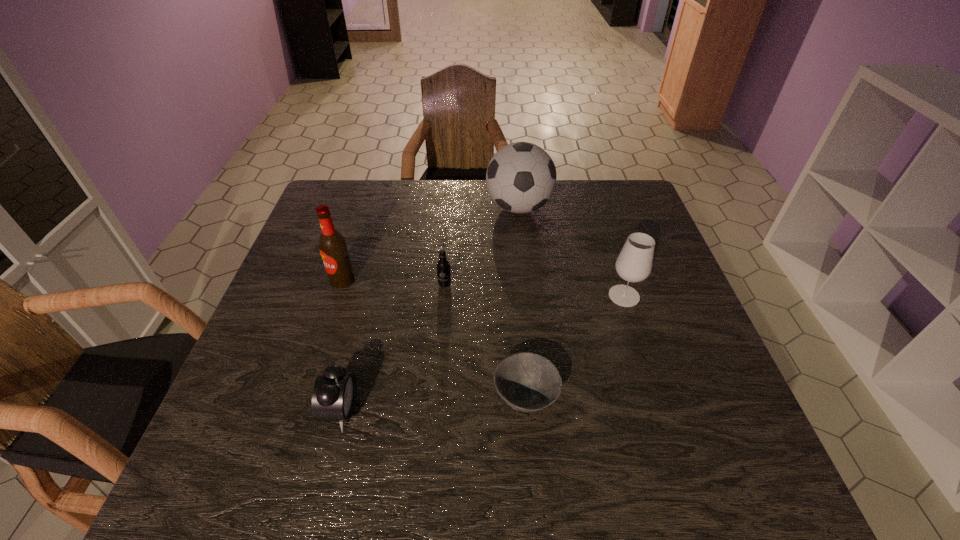
Where is `empty space that is in between the leftmost object and the third shortest object`? The height and width of the screenshot is (540, 960). empty space that is in between the leftmost object and the third shortest object is located at coordinates (394, 282).

The width and height of the screenshot is (960, 540). In order to click on free area in between the root beer and the fifth object from right to left in this screenshot , I will do `click(393, 347)`.

Locate an element on the screen. vacant area between the bowl and the third tallest object is located at coordinates (575, 347).

The image size is (960, 540). I want to click on free space between the fifth tallest object and the third object from left to right, so click(393, 347).

Where is `free space between the root beer and the farthest object`? free space between the root beer and the farthest object is located at coordinates (482, 246).

Locate which object ranks second in proximity to the fourth object from right to left. Please provide its 2D coordinates. Your answer should be formatted as a tuple, i.e. [(x, y)], where the tuple contains the x and y coordinates of a point satisfying the conditions above.

[(521, 177)]

Image resolution: width=960 pixels, height=540 pixels. I want to click on the fourth closest object to the root beer, so click(334, 395).

Locate an element on the screen. vacant space that satisfies the following two spatial constraints: 1. on the label of the root beer; 2. on the front side of the alarm clock is located at coordinates (435, 410).

The image size is (960, 540). I want to click on free space that satisfies the following two spatial constraints: 1. on the label of the third shortest object; 2. on the front side of the fifth object from right to left, so click(x=435, y=410).